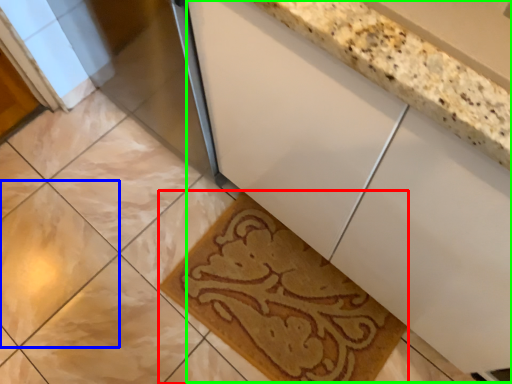
Question: Considering the real-world distances, which object is closest to bath mat (highlighted by a red box)? ceramic tile (highlighted by a blue box) or counter (highlighted by a green box).

Choices:
 (A) ceramic tile
 (B) counter

Answer: (B)